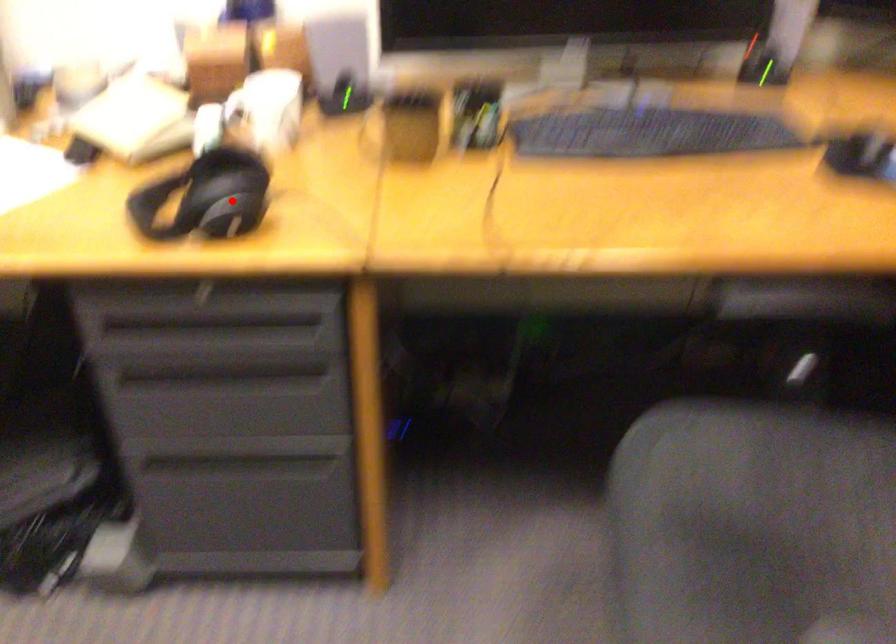
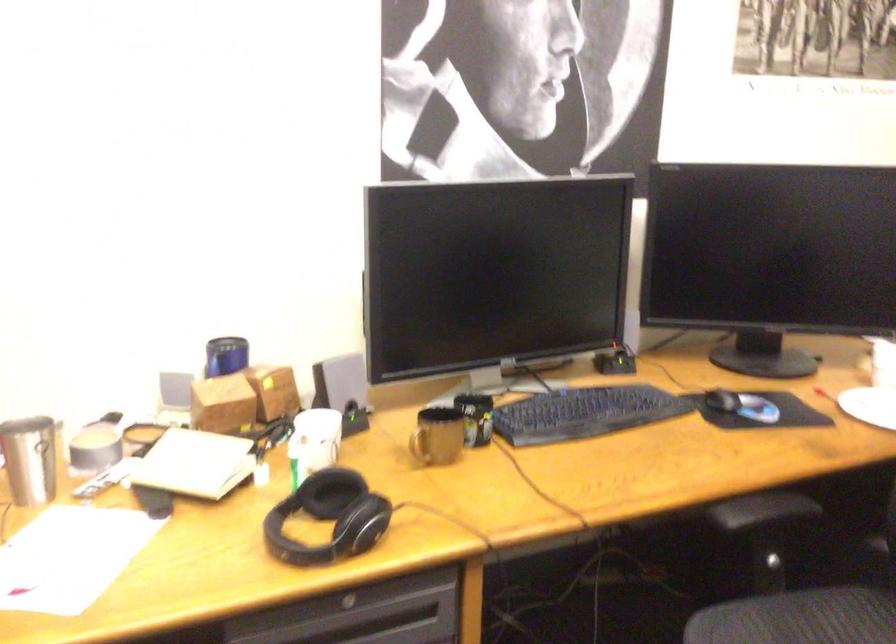
Question: I am providing you with two images of the same scene from different viewpoints. Given a red point in image1, look at the same physical point in image2. Is it:

Choices:
 (A) Closer to the viewpoint
 (B) Farther from the viewpoint

Answer: (B)